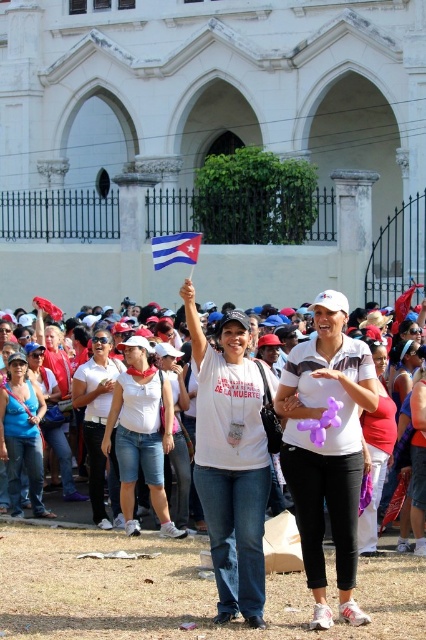
Question: Which is nearer to the white cotton shirt at center?

Choices:
 (A) white cotton t-shirt at center
 (B) denim shorts at center

Answer: (B)

Question: Which object appears farthest from the camera in this image?

Choices:
 (A) matte white tank top at center
 (B) denim jeans at lower left
 (C) white cotton t-shirt at center

Answer: (B)

Question: Can you confirm if denim jeans at lower left is positioned below white cotton shirt at center?

Choices:
 (A) no
 (B) yes

Answer: (B)

Question: Is red fabric flag at center closer to the viewer compared to blue fabric flag at center?

Choices:
 (A) yes
 (B) no

Answer: (A)

Question: Can you confirm if white matte balloon animal at center is positioned to the right of denim jeans at lower left?

Choices:
 (A) no
 (B) yes

Answer: (B)

Question: Among these points, which one is nearest to the camera?

Choices:
 (A) (344, 611)
 (B) (408, 298)

Answer: (A)